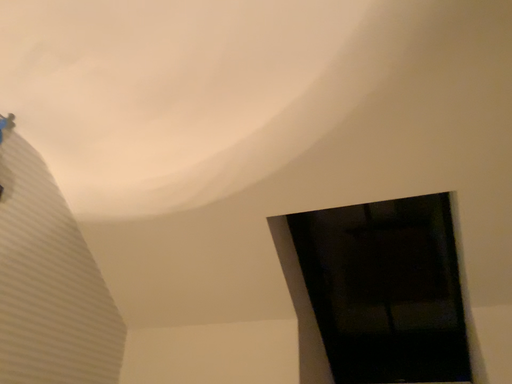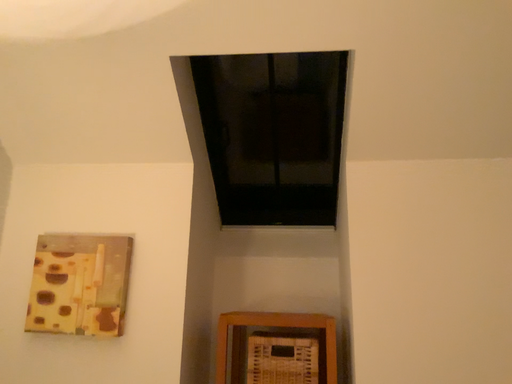
Question: How did the camera likely rotate when shooting the video?

Choices:
 (A) rotated downward
 (B) rotated upward

Answer: (A)